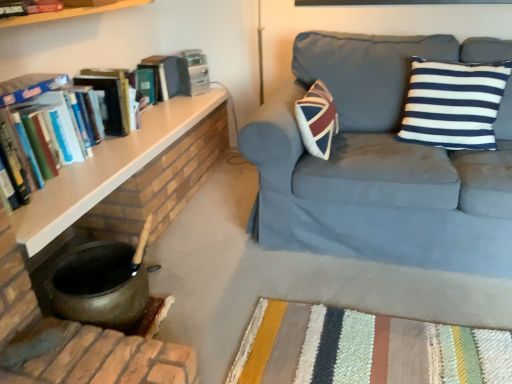
Question: Can you confirm if hardcover book at upper left is shorter than suede blue couch at upper right?

Choices:
 (A) no
 (B) yes

Answer: (B)

Question: From a real-world perspective, is hardcover book at upper left physically below suede blue couch at upper right?

Choices:
 (A) yes
 (B) no

Answer: (B)

Question: Is hardcover book at upper left to the right of suede blue couch at upper right from the viewer's perspective?

Choices:
 (A) yes
 (B) no

Answer: (B)

Question: From the image's perspective, is hardcover book at upper left on top of suede blue couch at upper right?

Choices:
 (A) yes
 (B) no

Answer: (A)

Question: From a real-world perspective, is hardcover book at upper left over suede blue couch at upper right?

Choices:
 (A) no
 (B) yes

Answer: (B)

Question: In terms of size, does hardcover book at upper left, positioned as the 1th book in top-to-bottom order, appear bigger or smaller than suede blue couch at upper right?

Choices:
 (A) small
 (B) big

Answer: (A)

Question: From the image's perspective, is hardcover book at upper left, positioned as the 1th book in top-to-bottom order, above or below suede blue couch at upper right?

Choices:
 (A) below
 (B) above

Answer: (B)

Question: In terms of width, does hardcover book at upper left, placed as the second book when sorted from bottom to top, look wider or thinner when compared to suede blue couch at upper right?

Choices:
 (A) wide
 (B) thin

Answer: (B)

Question: Relative to suede blue couch at upper right, is hardcover book at upper left, placed as the second book when sorted from bottom to top, in front or behind?

Choices:
 (A) behind
 (B) front

Answer: (A)

Question: Do you think wooden shelf at left is within hardcover book at upper left, or outside of it?

Choices:
 (A) outside
 (B) inside

Answer: (A)

Question: Is wooden shelf at left taller or shorter than hardcover book at upper left?

Choices:
 (A) short
 (B) tall

Answer: (A)

Question: Would you say wooden shelf at left is to the left or to the right of hardcover book at upper left in the picture?

Choices:
 (A) right
 (B) left

Answer: (B)

Question: From the image's perspective, is wooden shelf at left positioned above or below hardcover book at upper left?

Choices:
 (A) below
 (B) above

Answer: (A)

Question: From their relative heights in the image, would you say suede blue couch at upper right is taller or shorter than hardcover book at upper left?

Choices:
 (A) short
 (B) tall

Answer: (B)

Question: Does point (318, 220) appear closer or farther from the camera than point (173, 82)?

Choices:
 (A) farther
 (B) closer

Answer: (B)